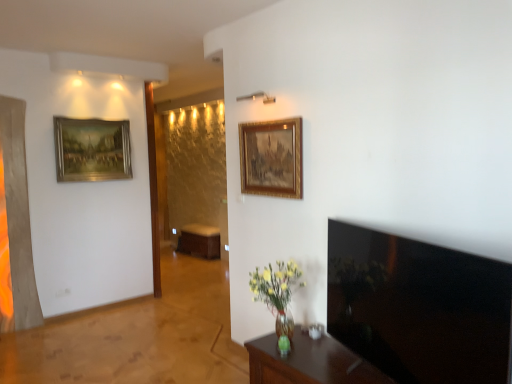
This screenshot has height=384, width=512. What are the coordinates of `gold-framed painting at upper left, the second picture frame from the front` in the screenshot? It's located at (92, 149).

Find the location of a particular element. brown wooden table at center is located at coordinates (200, 241).

What do you see at coordinates (309, 362) in the screenshot?
I see `brown wooden table at lower right` at bounding box center [309, 362].

Measure the distance between point [262,167] and camera.

A distance of 3.09 meters exists between point [262,167] and camera.

I want to click on gold/gilded picture frame at upper center, positioned as the second picture frame in back-to-front order, so click(271, 158).

The height and width of the screenshot is (384, 512). I want to click on gold-framed painting at upper left, the second picture frame from the front, so [x=92, y=149].

Where is `television on the right side of brown wooden table at center`? The height and width of the screenshot is (384, 512). television on the right side of brown wooden table at center is located at coordinates (418, 307).

Between brown wooden table at center and black glossy tv at right, which one has less height?

brown wooden table at center.

Which object is thinner, brown wooden table at center or black glossy tv at right?

Thinner between the two is black glossy tv at right.

From a real-world perspective, is black glossy tv at right on top of gold/gilded picture frame at upper center, positioned as the second picture frame in back-to-front order?

No, from a real-world perspective, black glossy tv at right is not on top of gold/gilded picture frame at upper center, positioned as the second picture frame in back-to-front order.

Between black glossy tv at right and gold/gilded picture frame at upper center, which appears as the 1th picture frame when viewed from the front, which one is positioned in front?

black glossy tv at right is more forward.

Can you tell me how much black glossy tv at right and gold/gilded picture frame at upper center, arranged as the 2th picture frame when viewed from the left, differ in facing direction?

They differ by 19.8 degrees in their facing directions.

Is black glossy tv at right turned away from gold/gilded picture frame at upper center, arranged as the 2th picture frame when viewed from the left?

black glossy tv at right does not have its back to gold/gilded picture frame at upper center, arranged as the 2th picture frame when viewed from the left.

Which is more to the right, black glossy tv at right or brown wooden table at center?

From the viewer's perspective, black glossy tv at right appears more on the right side.

From the image's perspective, who appears lower, black glossy tv at right or brown wooden table at center?

brown wooden table at center, from the image's perspective.

Which is correct: black glossy tv at right is inside brown wooden table at center, or outside of it?

The correct answer is: outside.

Are black glossy tv at right and brown wooden table at center located far from each other?

Yes, black glossy tv at right and brown wooden table at center are located far from each other.

The height and width of the screenshot is (384, 512). I want to click on the 1st picture frame counting from the left of the brown wooden table at lower right, so click(x=271, y=158).

From a real-world perspective, relative to gold/gilded picture frame at upper center, positioned as the second picture frame in back-to-front order, is brown wooden table at lower right vertically above or below?

brown wooden table at lower right is situated lower than gold/gilded picture frame at upper center, positioned as the second picture frame in back-to-front order, in the real world.

Considering the positions of objects brown wooden table at lower right and gold/gilded picture frame at upper center, which appears as the 1th picture frame when viewed from the front, in the image provided, who is more to the left, brown wooden table at lower right or gold/gilded picture frame at upper center, which appears as the 1th picture frame when viewed from the front,?

gold/gilded picture frame at upper center, which appears as the 1th picture frame when viewed from the front, is more to the left.

Looking at this image, measure the distance between brown wooden table at lower right and gold-framed painting at upper left, the second picture frame from the front.

A distance of 9.34 feet exists between brown wooden table at lower right and gold-framed painting at upper left, the second picture frame from the front.

Do you think brown wooden table at lower right is within gold-framed painting at upper left, placed as the 1th picture frame when sorted from back to front, or outside of it?

brown wooden table at lower right is outside gold-framed painting at upper left, placed as the 1th picture frame when sorted from back to front.

From the image's perspective, between brown wooden table at lower right and gold-framed painting at upper left, marked as the 2th picture frame in a right-to-left arrangement, who is located below?

brown wooden table at lower right, from the image's perspective.

Where is `furniture lying below the gold-framed painting at upper left, the 1th picture frame viewed from the left (from the image's perspective)`? Image resolution: width=512 pixels, height=384 pixels. furniture lying below the gold-framed painting at upper left, the 1th picture frame viewed from the left (from the image's perspective) is located at coordinates (309, 362).

Between brown wooden table at center and gold/gilded picture frame at upper center, arranged as the 2th picture frame when viewed from the left, which one has more height?

With more height is gold/gilded picture frame at upper center, arranged as the 2th picture frame when viewed from the left.

Measure the distance from brown wooden table at center to gold/gilded picture frame at upper center, which appears as the 1th picture frame when viewed from the front.

3.93 meters.

Does point (210, 227) appear closer or farther from the camera than point (284, 147)?

Point (210, 227) is farther from the camera than point (284, 147).

Considering the positions of objects brown wooden table at center and brown wooden table at lower right in the image provided, who is more to the right, brown wooden table at center or brown wooden table at lower right?

brown wooden table at lower right is more to the right.

Looking at this image, which object is further away from the camera, brown wooden table at center or brown wooden table at lower right?

brown wooden table at center is further away from the camera.

Would you say brown wooden table at center is outside brown wooden table at lower right?

Yes.

Locate an element on the screen. The width and height of the screenshot is (512, 384). table above the brown wooden table at lower right (from a real-world perspective) is located at coordinates (200, 241).

The height and width of the screenshot is (384, 512). Identify the location of table below the black glossy tv at right (from the image's perspective). (200, 241).

From the image's perspective, count 1st picture frames upward from the black glossy tv at right and point to it. Please provide its 2D coordinates.

[(271, 158)]

Considering their positions, is gold-framed painting at upper left, marked as the 2th picture frame in a right-to-left arrangement, positioned further to brown wooden table at center than gold/gilded picture frame at upper center, arranged as the 2th picture frame when viewed from the left?

gold/gilded picture frame at upper center, arranged as the 2th picture frame when viewed from the left, is further to brown wooden table at center.

Looking at the image, which one is located further to brown wooden table at lower right, black glossy tv at right or gold/gilded picture frame at upper center, acting as the 1th picture frame starting from the right?

gold/gilded picture frame at upper center, acting as the 1th picture frame starting from the right, is further to brown wooden table at lower right.

Estimate the real-world distances between objects in this image. Which object is closer to black glossy tv at right, gold/gilded picture frame at upper center, which appears as the 1th picture frame when viewed from the front, or gold-framed painting at upper left, the second picture frame from the front?

Based on the image, gold/gilded picture frame at upper center, which appears as the 1th picture frame when viewed from the front, appears to be nearer to black glossy tv at right.

Consider the image. Looking at the image, which one is located closer to gold/gilded picture frame at upper center, acting as the 1th picture frame starting from the right, black glossy tv at right or gold-framed painting at upper left, marked as the 2th picture frame in a right-to-left arrangement?

Among the two, black glossy tv at right is located nearer to gold/gilded picture frame at upper center, acting as the 1th picture frame starting from the right.

Which object lies further to the anchor point brown wooden table at lower right, gold-framed painting at upper left, the 1th picture frame viewed from the left, or brown wooden table at center?

Among the two, brown wooden table at center is located further to brown wooden table at lower right.

Looking at the image, which one is located closer to brown wooden table at lower right, gold/gilded picture frame at upper center, positioned as the second picture frame in back-to-front order, or brown wooden table at center?

Based on the image, gold/gilded picture frame at upper center, positioned as the second picture frame in back-to-front order, appears to be nearer to brown wooden table at lower right.

When comparing their distances from gold-framed painting at upper left, the 1th picture frame viewed from the left, does black glossy tv at right or brown wooden table at center seem further?

Result: black glossy tv at right lies further to gold-framed painting at upper left, the 1th picture frame viewed from the left, than the other object.

When comparing their distances from brown wooden table at lower right, does black glossy tv at right or brown wooden table at center seem closer?

black glossy tv at right is positioned closer to the anchor brown wooden table at lower right.

Image resolution: width=512 pixels, height=384 pixels. I want to click on television that lies between gold/gilded picture frame at upper center, arranged as the 2th picture frame when viewed from the left, and brown wooden table at lower right from top to bottom, so click(418, 307).

Find the location of a particular element. The height and width of the screenshot is (384, 512). furniture located between black glossy tv at right and brown wooden table at center in the depth direction is located at coordinates (309, 362).

Where is `picture frame between gold/gilded picture frame at upper center, acting as the 1th picture frame starting from the right, and brown wooden table at center, along the z-axis`? picture frame between gold/gilded picture frame at upper center, acting as the 1th picture frame starting from the right, and brown wooden table at center, along the z-axis is located at coordinates (92, 149).

The image size is (512, 384). Identify the location of picture frame between gold-framed painting at upper left, the 1th picture frame viewed from the left, and brown wooden table at lower right. (271, 158).